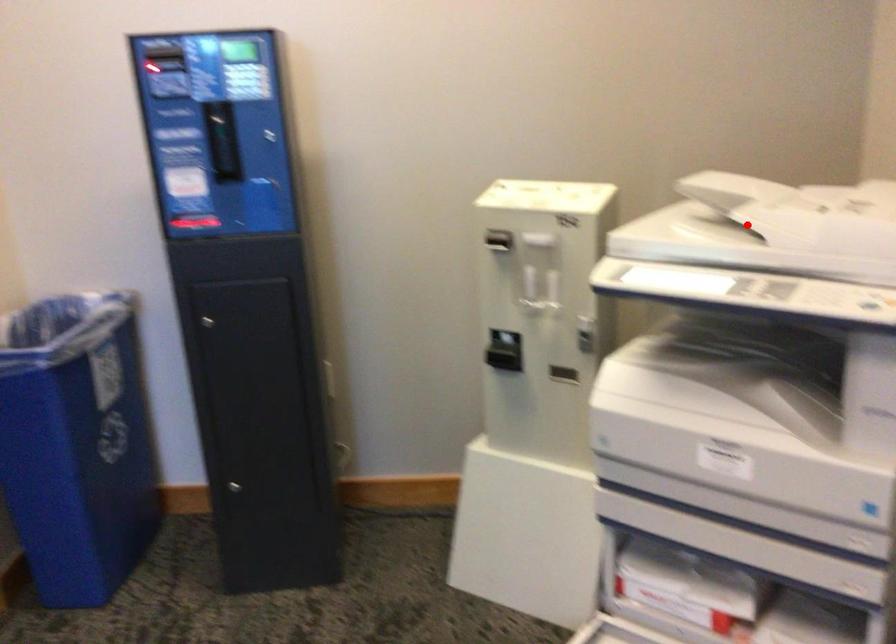
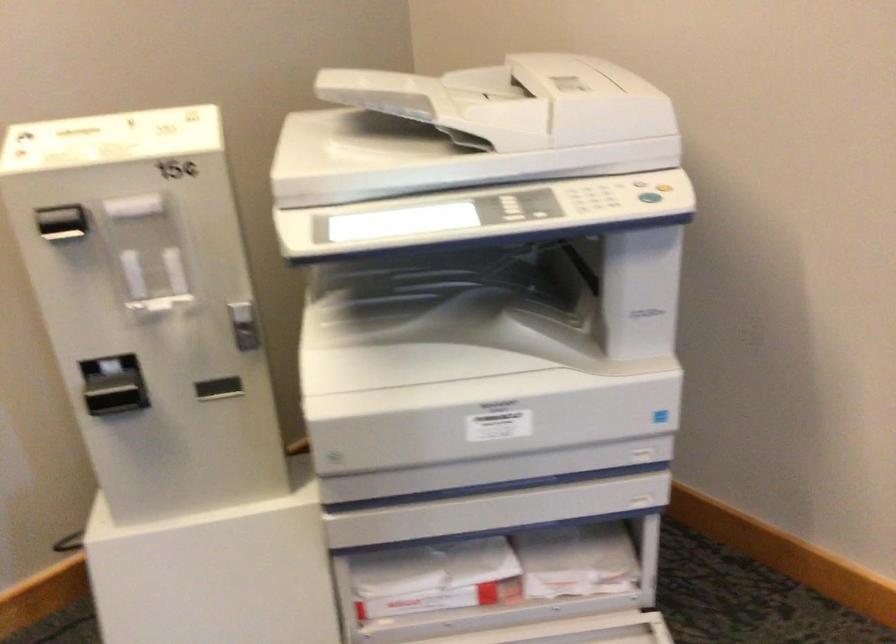
Question: A red point is marked in image1. In image2, is the corresponding 3D point closer to the camera or farther? Reply with the corresponding letter.

Choices:
 (A) The corresponding 3D point is closer.
 (B) The corresponding 3D point is farther.

Answer: (A)